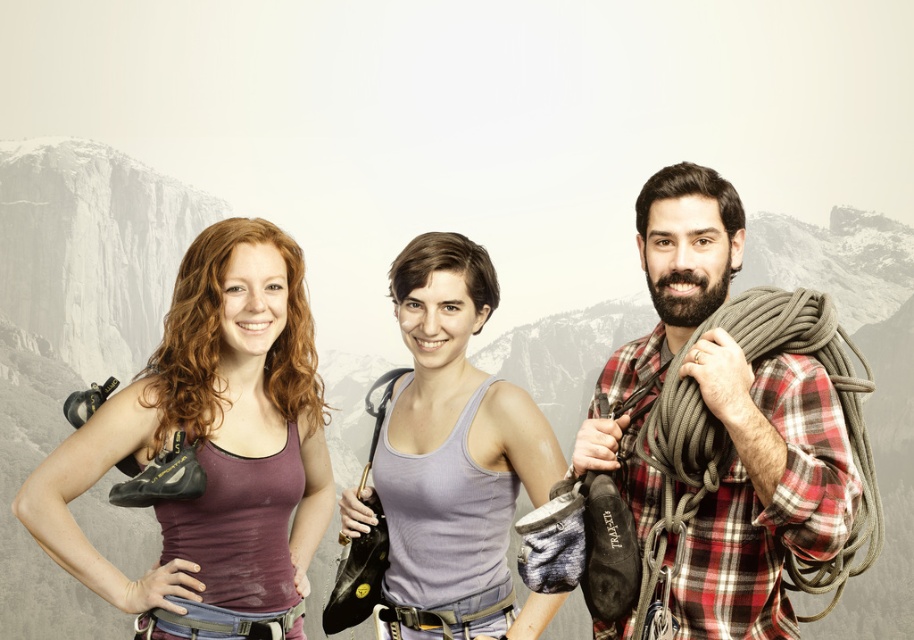
Question: Is matte purple tank top at center to the left of purple matte tank top at center from the viewer's perspective?

Choices:
 (A) yes
 (B) no

Answer: (A)

Question: Considering the relative positions of plaid flannel shirt at center and purple matte tank top at center in the image provided, where is plaid flannel shirt at center located with respect to purple matte tank top at center?

Choices:
 (A) left
 (B) right

Answer: (B)

Question: Which of the following is the closest to the observer?

Choices:
 (A) (816, 481)
 (B) (213, 433)

Answer: (A)

Question: Which point is farther to the camera?

Choices:
 (A) matte purple tank top at center
 (B) purple matte tank top at center
 (C) plaid flannel shirt at center

Answer: (B)

Question: Can you confirm if matte purple tank top at center is thinner than plaid flannel shirt at center?

Choices:
 (A) yes
 (B) no

Answer: (B)

Question: Among these objects, which one is farthest from the camera?

Choices:
 (A) plaid flannel shirt at center
 (B) matte purple tank top at center
 (C) purple matte tank top at center

Answer: (C)